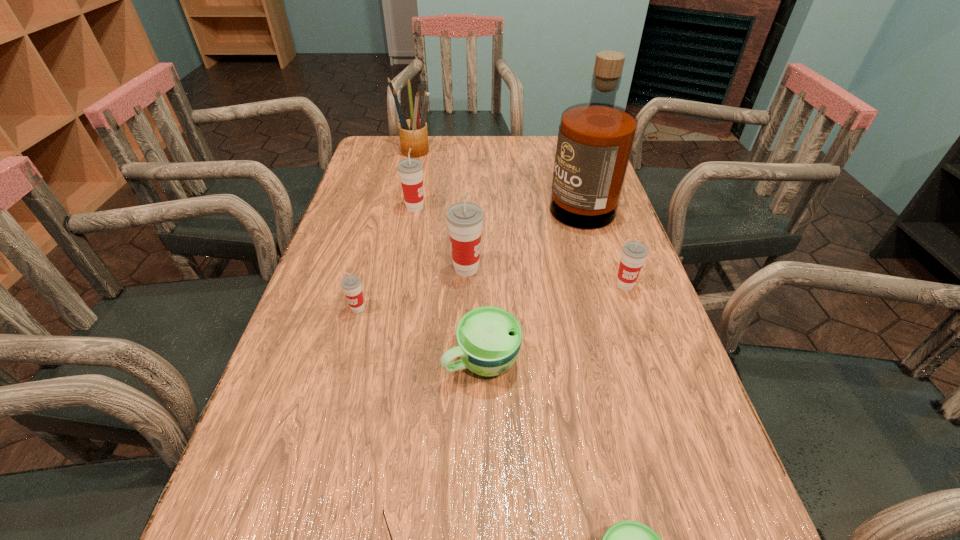
Locate an element on the screen. The width and height of the screenshot is (960, 540). the third shortest cup is located at coordinates (351, 284).

This screenshot has width=960, height=540. In order to click on the second shortest cup in this screenshot , I will do `click(489, 338)`.

Identify the location of the seventh farthest object. This screenshot has height=540, width=960. (489, 338).

Locate an element on the screen. vacant space located 0.120m on the front label of the tallest object is located at coordinates (504, 197).

The image size is (960, 540). Find the location of `free space located 0.070m on the front label of the tallest object`. free space located 0.070m on the front label of the tallest object is located at coordinates (522, 197).

Where is `vacant space positioned 0.060m on the front label of the tallest object`? Image resolution: width=960 pixels, height=540 pixels. vacant space positioned 0.060m on the front label of the tallest object is located at coordinates (525, 197).

Where is `vacant space located on the front of the pencil box`? vacant space located on the front of the pencil box is located at coordinates (400, 213).

Where is `vacant space located 0.210m on the side of the tallest cup with the logo`? This screenshot has width=960, height=540. vacant space located 0.210m on the side of the tallest cup with the logo is located at coordinates (573, 268).

Locate an element on the screen. The width and height of the screenshot is (960, 540). vacant space positioned on the side of the fifth shortest cup with the logo is located at coordinates (555, 208).

At what (x,y) coordinates should I click in order to perform the action: click on free spot located on the side of the fourth shortest cup with the logo. Please return your answer as a coordinate pair (x, y). Looking at the image, I should click on (663, 397).